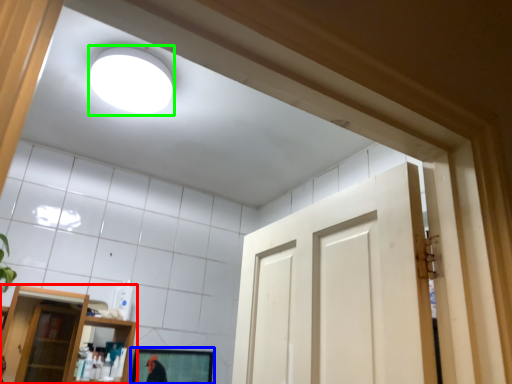
Question: Which object is the closest to the shelf (highlighted by a red box)? Choose among these: mirror (highlighted by a blue box) or lighting (highlighted by a green box).

Choices:
 (A) mirror
 (B) lighting

Answer: (A)